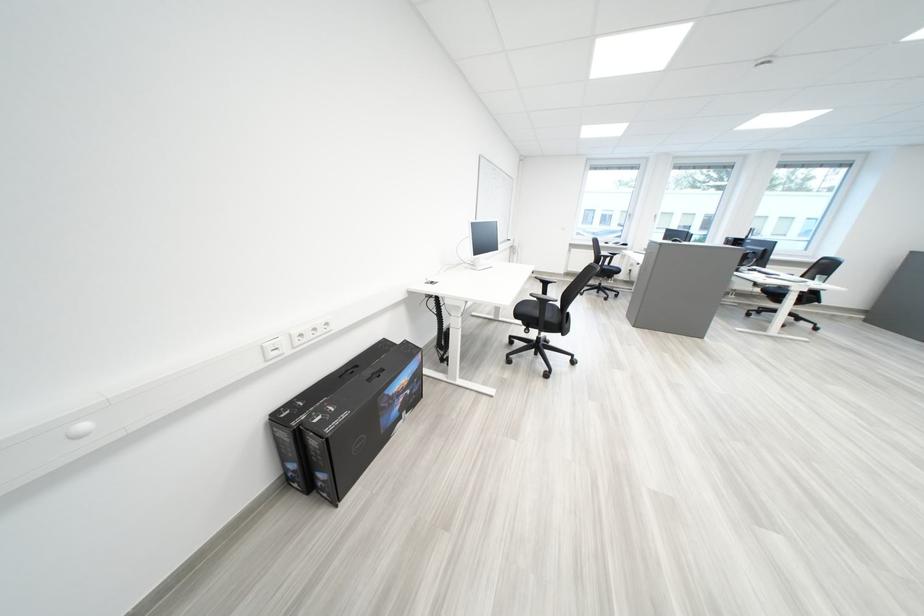
Image resolution: width=924 pixels, height=616 pixels. I want to click on white light switch, so click(273, 347).